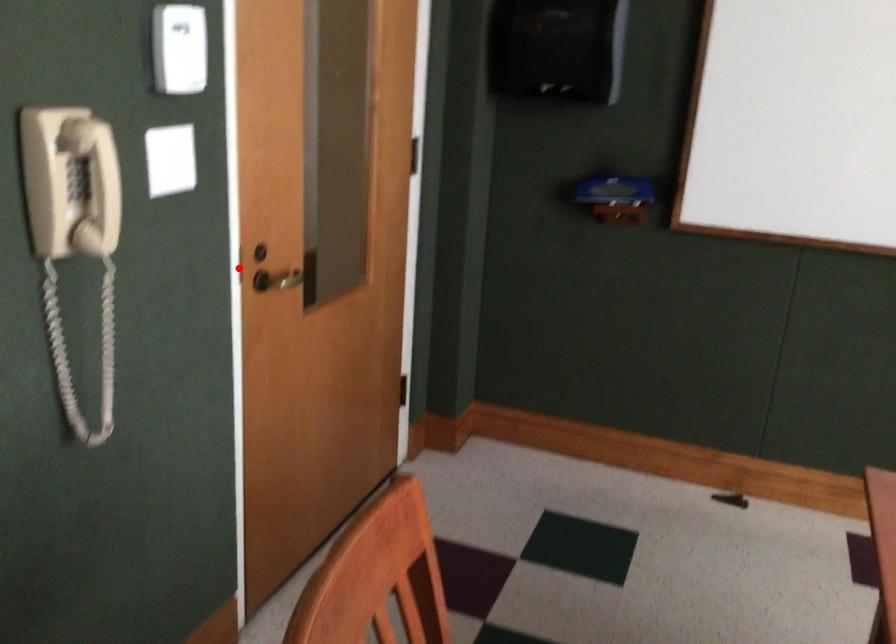
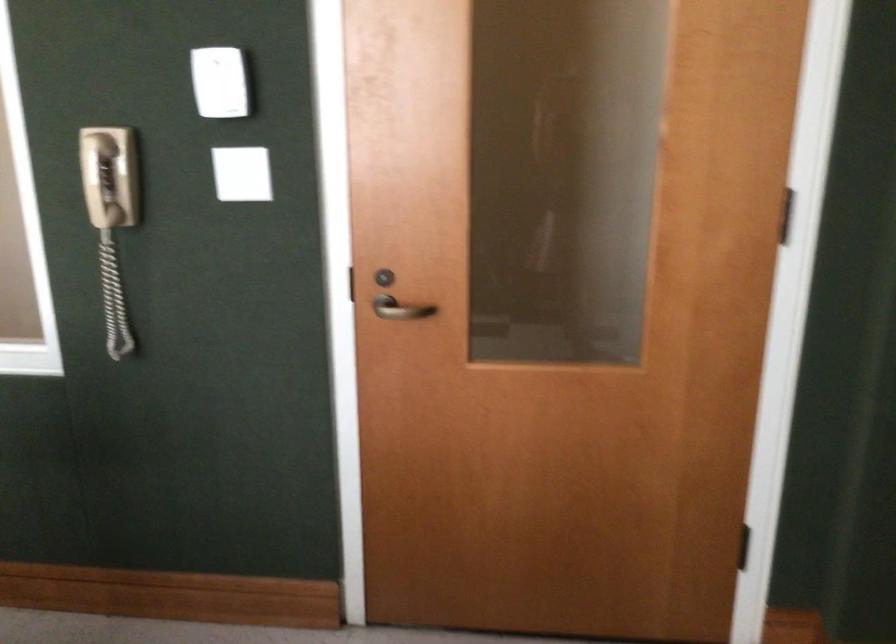
Where in the second image is the point corresponding to the highlighted location from the first image?

(346, 283)